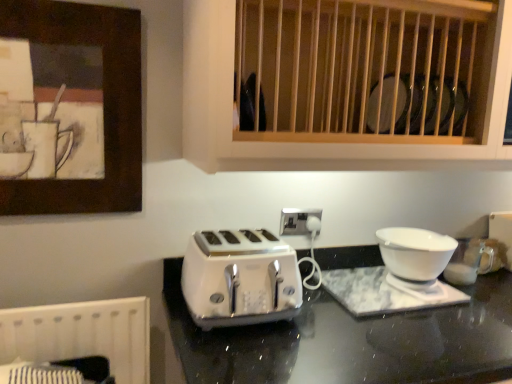
Question: Does wooden slats at upper center have a lesser height compared to white glossy toaster at center?

Choices:
 (A) no
 (B) yes

Answer: (A)

Question: Is wooden slats at upper center positioned before white glossy toaster at center?

Choices:
 (A) no
 (B) yes

Answer: (B)

Question: Is wooden slats at upper center wider than white glossy toaster at center?

Choices:
 (A) yes
 (B) no

Answer: (A)

Question: Can you confirm if wooden slats at upper center is bigger than white glossy toaster at center?

Choices:
 (A) yes
 (B) no

Answer: (A)

Question: Is wooden slats at upper center not near white glossy toaster at center?

Choices:
 (A) no
 (B) yes

Answer: (A)

Question: Would you say wooden slats at upper center is inside or outside white glossy toaster at center?

Choices:
 (A) outside
 (B) inside

Answer: (A)

Question: Is wooden slats at upper center bigger or smaller than white glossy toaster at center?

Choices:
 (A) big
 (B) small

Answer: (A)

Question: Is point (196, 137) closer or farther from the camera than point (293, 291)?

Choices:
 (A) closer
 (B) farther

Answer: (A)

Question: Relative to white glossy toaster at center, is wooden slats at upper center in front or behind?

Choices:
 (A) behind
 (B) front

Answer: (B)

Question: Is white glossy bowl at right taller or shorter than white plastic electric outlet at center?

Choices:
 (A) tall
 (B) short

Answer: (A)

Question: From the image's perspective, relative to white plastic electric outlet at center, is white glossy bowl at right above or below?

Choices:
 (A) below
 (B) above

Answer: (A)

Question: Is white glossy bowl at right inside or outside of white plastic electric outlet at center?

Choices:
 (A) inside
 (B) outside

Answer: (B)

Question: Relative to white plastic electric outlet at center, is white glossy bowl at right in front or behind?

Choices:
 (A) front
 (B) behind

Answer: (A)

Question: Considering the positions of wooden slats at upper center and white plastic electric outlet at center in the image, is wooden slats at upper center wider or thinner than white plastic electric outlet at center?

Choices:
 (A) thin
 (B) wide

Answer: (B)

Question: Considering the positions of wooden slats at upper center and white plastic electric outlet at center in the image, is wooden slats at upper center taller or shorter than white plastic electric outlet at center?

Choices:
 (A) short
 (B) tall

Answer: (B)